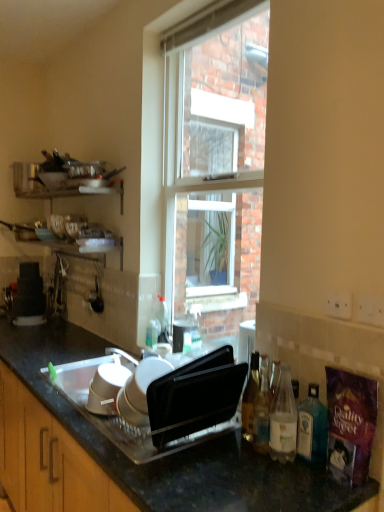
Question: Is translucent glass bottle at lower right, positioned as the 2th bottle in right-to-left order, far from translucent glass bottle at lower right, which is counted as the 3th bottle, starting from the right?

Choices:
 (A) no
 (B) yes

Answer: (A)

Question: Considering the relative sizes of translucent glass bottle at lower right, acting as the third bottle starting from the left, and translucent glass bottle at lower right, which is counted as the 3th bottle, starting from the right, in the image provided, is translucent glass bottle at lower right, acting as the third bottle starting from the left, smaller than translucent glass bottle at lower right, which is counted as the 3th bottle, starting from the right,?

Choices:
 (A) no
 (B) yes

Answer: (A)

Question: Does translucent glass bottle at lower right, acting as the third bottle starting from the left, have a lesser width compared to translucent glass bottle at lower right, acting as the second bottle starting from the left?

Choices:
 (A) no
 (B) yes

Answer: (A)

Question: From a real-world perspective, is translucent glass bottle at lower right, positioned as the 2th bottle in right-to-left order, over translucent glass bottle at lower right, which is counted as the 3th bottle, starting from the right?

Choices:
 (A) yes
 (B) no

Answer: (A)

Question: Considering the relative positions of translucent glass bottle at lower right, positioned as the 2th bottle in right-to-left order, and translucent glass bottle at lower right, acting as the second bottle starting from the left, in the image provided, is translucent glass bottle at lower right, positioned as the 2th bottle in right-to-left order, behind translucent glass bottle at lower right, acting as the second bottle starting from the left,?

Choices:
 (A) no
 (B) yes

Answer: (A)

Question: In the image, is clear glass window at center positioned in front of or behind translucent glass bottle at right, positioned as the fourth bottle in right-to-left order?

Choices:
 (A) behind
 (B) front

Answer: (A)

Question: Is point (183, 154) closer or farther from the camera than point (248, 414)?

Choices:
 (A) closer
 (B) farther

Answer: (B)

Question: From their relative heights in the image, would you say clear glass window at center is taller or shorter than translucent glass bottle at right, marked as the first bottle in a left-to-right arrangement?

Choices:
 (A) tall
 (B) short

Answer: (A)

Question: From the image's perspective, is clear glass window at center positioned above or below translucent glass bottle at right, positioned as the fourth bottle in right-to-left order?

Choices:
 (A) above
 (B) below

Answer: (A)

Question: From the image's perspective, is translucent glass bottle at right, the 4th bottle positioned from the left, positioned above or below translucent glass bottle at lower right, which is counted as the 3th bottle, starting from the right?

Choices:
 (A) below
 (B) above

Answer: (A)

Question: Based on their positions, is translucent glass bottle at right, the 4th bottle positioned from the left, located to the left or right of translucent glass bottle at lower right, which is counted as the 3th bottle, starting from the right?

Choices:
 (A) left
 (B) right

Answer: (B)

Question: Considering the positions of translucent glass bottle at right, which ranks as the 1th bottle in right-to-left order, and translucent glass bottle at lower right, which is counted as the 3th bottle, starting from the right, in the image, is translucent glass bottle at right, which ranks as the 1th bottle in right-to-left order, wider or thinner than translucent glass bottle at lower right, which is counted as the 3th bottle, starting from the right,?

Choices:
 (A) thin
 (B) wide

Answer: (A)

Question: From a real-world perspective, relative to translucent glass bottle at lower right, acting as the second bottle starting from the left, is translucent glass bottle at right, which ranks as the 1th bottle in right-to-left order, vertically above or below?

Choices:
 (A) above
 (B) below

Answer: (B)

Question: Is translucent glass bottle at lower right, positioned as the 2th bottle in right-to-left order, in front of or behind translucent glass bottle at right, marked as the first bottle in a left-to-right arrangement, in the image?

Choices:
 (A) front
 (B) behind

Answer: (A)

Question: In terms of height, does translucent glass bottle at lower right, positioned as the 2th bottle in right-to-left order, look taller or shorter compared to translucent glass bottle at right, positioned as the fourth bottle in right-to-left order?

Choices:
 (A) tall
 (B) short

Answer: (A)